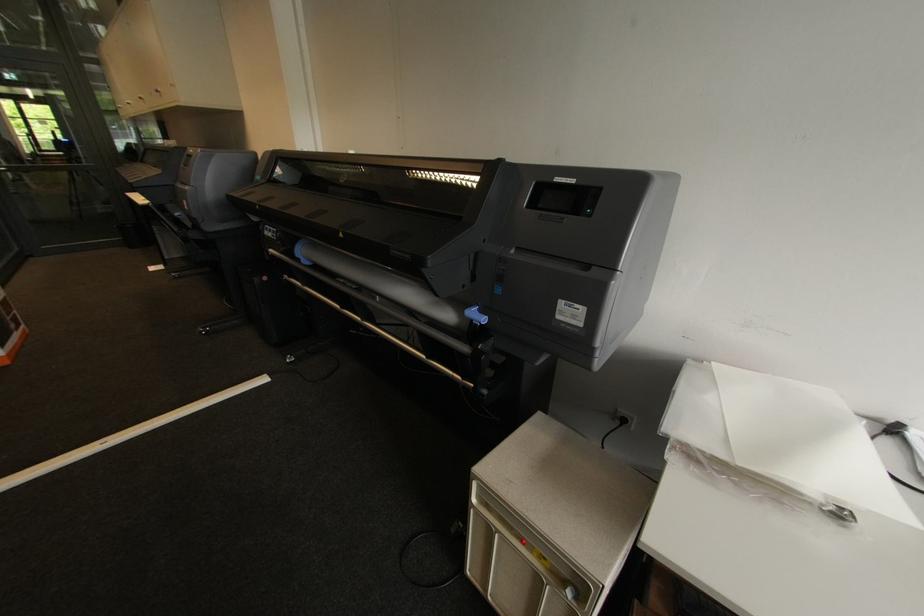
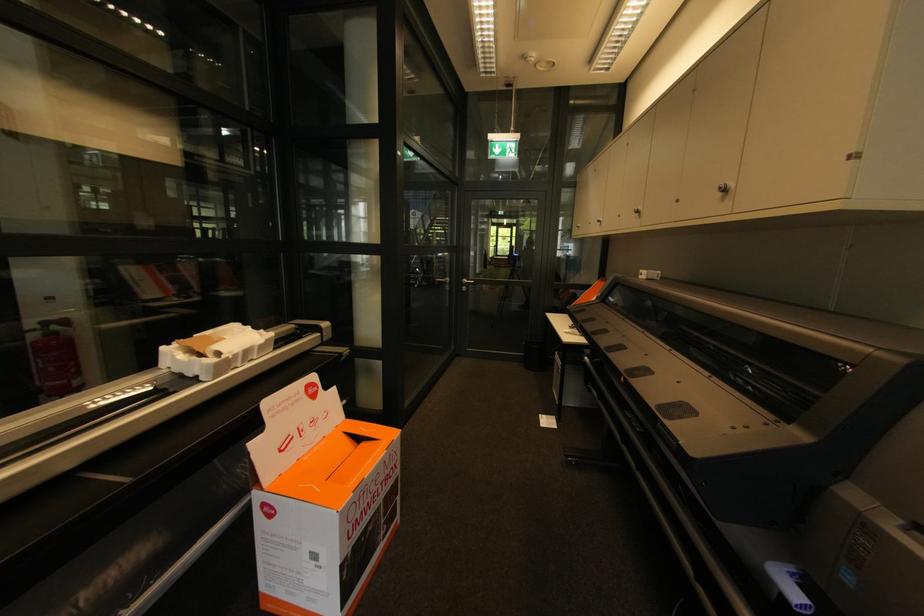
Find the pixel in the second image that matches point (162, 92) in the first image.

(727, 191)